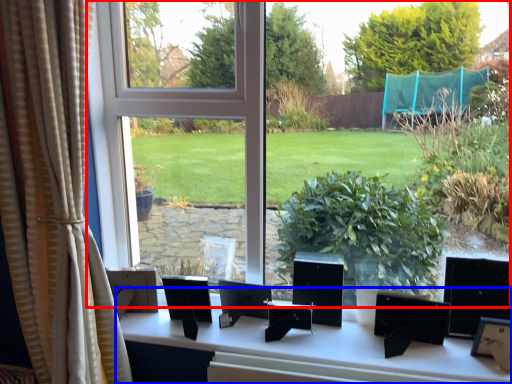
Question: Which point is closer to the camera, window (highlighted by a red box) or table (highlighted by a blue box)?

Choices:
 (A) window
 (B) table

Answer: (A)